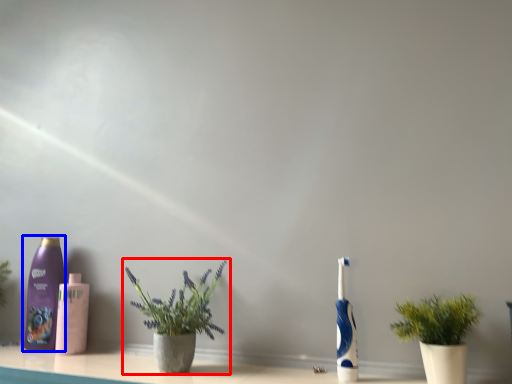
Question: Which point is closer to the camera, houseplant (highlighted by a red box) or bottle (highlighted by a blue box)?

Choices:
 (A) houseplant
 (B) bottle

Answer: (A)